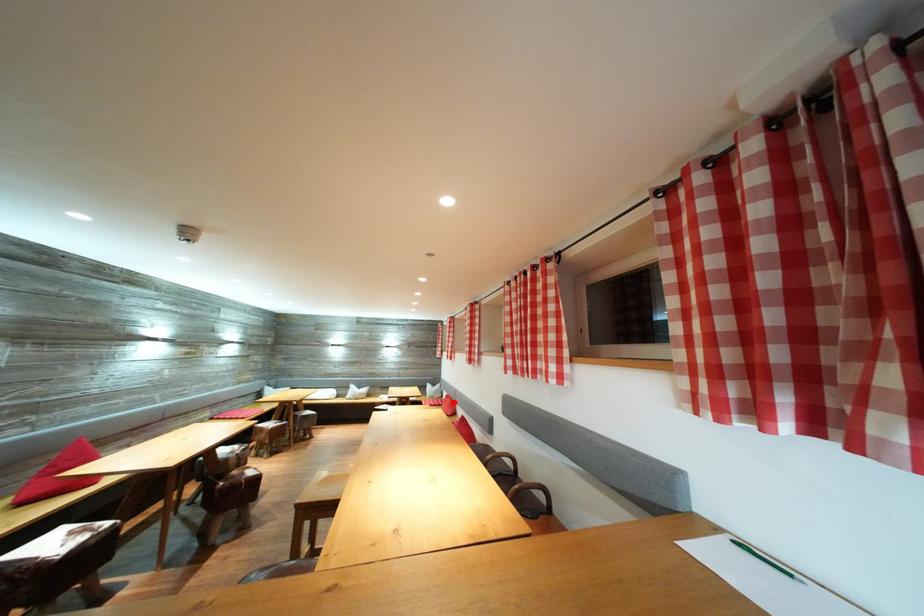
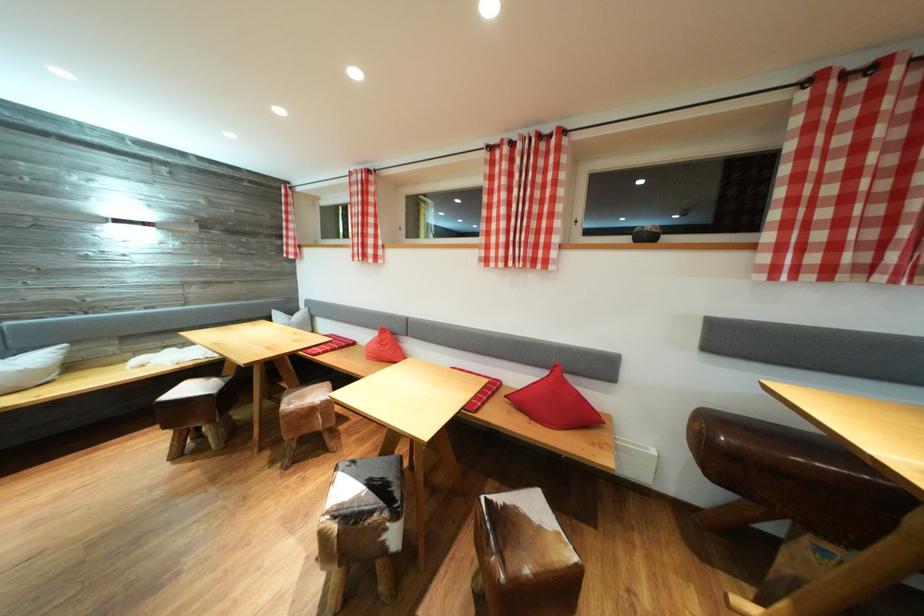
In the second image, find the point that corresponds to the highlighted location in the first image.

(390, 336)